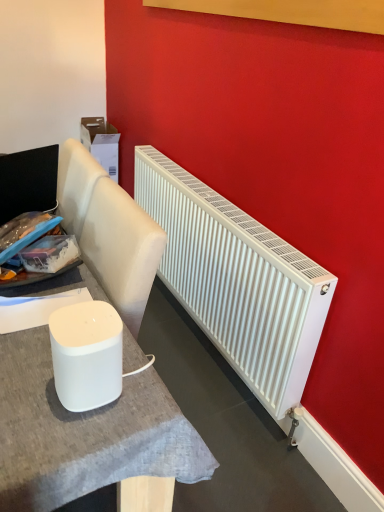
What do you see at coordinates (85, 433) in the screenshot? I see `white matte table at center` at bounding box center [85, 433].

Locate an element on the screen. white matte table at center is located at coordinates (85, 433).

Would you say white matte table at center is a long distance from white matte speaker at lower left?

No, white matte table at center is in close proximity to white matte speaker at lower left.

Where is `appliance behind the white matte table at center`? The height and width of the screenshot is (512, 384). appliance behind the white matte table at center is located at coordinates (86, 354).

Which is in front, point (52, 468) or point (98, 361)?

Point (52, 468)

From a real-world perspective, does white matte table at center stand above white matte speaker at lower left?

Actually, white matte table at center is physically below white matte speaker at lower left in the real world.

Is white matte table at center at the back of white matte speaker at lower left?

No.

Which is more to the right, white matte speaker at lower left or white matte table at center?

white matte speaker at lower left.

Is the depth of white matte speaker at lower left less than that of white matte table at center?

No, white matte speaker at lower left is further to the viewer.

From the image's perspective, would you say white matte radiator at right is shown under white matte table at center?

Actually, white matte radiator at right appears above white matte table at center in the image.

How many degrees apart are the facing directions of white matte radiator at right and white matte table at center?

The angular difference between white matte radiator at right and white matte table at center is 90 degrees.

The width and height of the screenshot is (384, 512). I want to click on table located in front of the white matte radiator at right, so click(x=85, y=433).

Is white matte speaker at lower left positioned beyond the bounds of white matte radiator at right?

Yes.

I want to click on radiator lying on the right of white matte speaker at lower left, so click(x=237, y=281).

From the image's perspective, does white matte speaker at lower left appear lower than white matte radiator at right?

Yes.

Considering the relative sizes of white matte speaker at lower left and white matte radiator at right in the image provided, is white matte speaker at lower left thinner than white matte radiator at right?

Correct, the width of white matte speaker at lower left is less than that of white matte radiator at right.

Considering the positions of objects white matte radiator at right and white matte speaker at lower left in the image provided, who is more to the left, white matte radiator at right or white matte speaker at lower left?

white matte speaker at lower left is more to the left.

Considering the relative sizes of white matte radiator at right and white matte speaker at lower left in the image provided, is white matte radiator at right thinner than white matte speaker at lower left?

In fact, white matte radiator at right might be wider than white matte speaker at lower left.

Which point is more forward, (x=210, y=247) or (x=85, y=388)?

The point (x=85, y=388) is in front.

From the image's perspective, which object appears higher, white matte radiator at right or white matte speaker at lower left?

white matte radiator at right, from the image's perspective.

From a real-world perspective, which is physically below, white matte table at center or white matte radiator at right?

white matte table at center.

Looking at this image, are white matte table at center and white matte radiator at right far apart?

white matte table at center is near white matte radiator at right, not far away.

Does white matte table at center have a lesser width compared to white matte radiator at right?

No.

Between point (92, 438) and point (177, 279), which one is positioned behind?

The point (177, 279) is farther.

The height and width of the screenshot is (512, 384). In order to click on table below the white matte speaker at lower left (from the image's perspective) in this screenshot , I will do `click(85, 433)`.

Locate an element on the screen. Image resolution: width=384 pixels, height=512 pixels. table beneath the white matte speaker at lower left (from a real-world perspective) is located at coordinates (85, 433).

From the picture: When comparing their distances from white matte radiator at right, does white matte table at center or white matte speaker at lower left seem closer?

Among the two, white matte table at center is located nearer to white matte radiator at right.

Which object lies nearer to the anchor point white matte speaker at lower left, white matte table at center or white matte radiator at right?

white matte table at center lies closer to white matte speaker at lower left than the other object.

Estimate the real-world distances between objects in this image. Which object is closer to white matte radiator at right, white matte speaker at lower left or white matte table at center?

Among the two, white matte table at center is located nearer to white matte radiator at right.

Looking at the image, which one is located further to white matte table at center, white matte radiator at right or white matte speaker at lower left?

Among the two, white matte radiator at right is located further to white matte table at center.

Estimate the real-world distances between objects in this image. Which object is closer to white matte speaker at lower left, white matte radiator at right or white matte table at center?

white matte table at center lies closer to white matte speaker at lower left than the other object.

Considering their positions, is white matte speaker at lower left positioned closer to white matte table at center than white matte radiator at right?

white matte speaker at lower left.

The height and width of the screenshot is (512, 384). I want to click on appliance located between white matte table at center and white matte radiator at right in the depth direction, so 86,354.